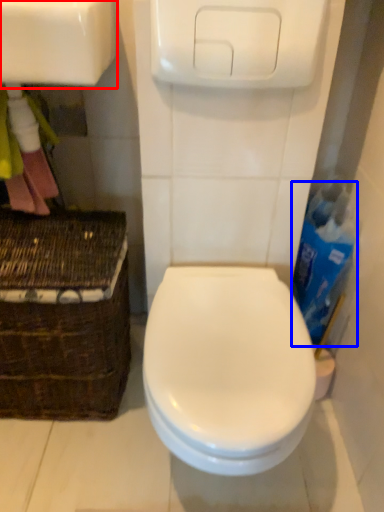
Question: Which object appears closest to the camera in this image, sink (highlighted by a red box) or cleaning product (highlighted by a blue box)?

Choices:
 (A) sink
 (B) cleaning product

Answer: (A)